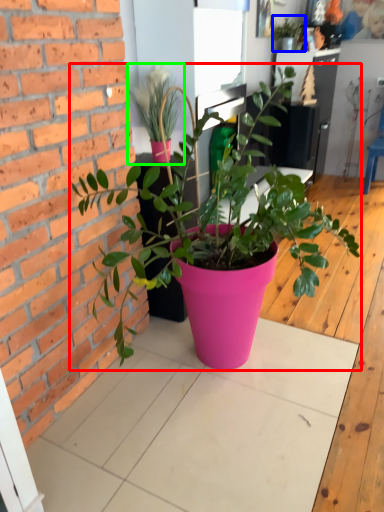
Question: Estimate the real-world distances between objects in this image. Which object is farther from houseplant (highlighted by a red box), houseplant (highlighted by a blue box) or houseplant (highlighted by a green box)?

Choices:
 (A) houseplant
 (B) houseplant

Answer: (A)